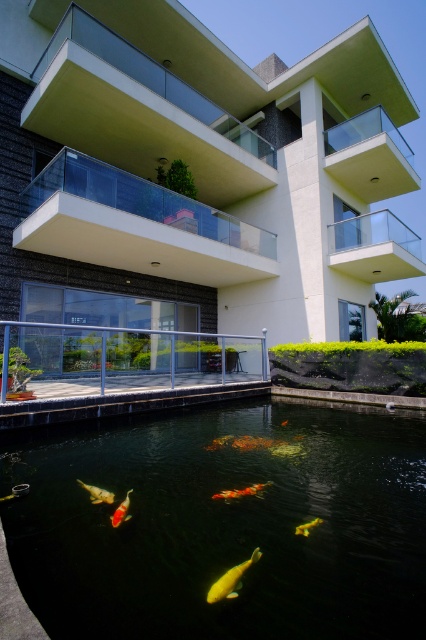
Is point (121, 516) closer to viewer compared to point (299, 532)?

No, (121, 516) is behind (299, 532).

Does shiny orange fish at center lie in front of shiny orange fish at lower center?

No.

Does point (114, 518) lie behind point (305, 529)?

Yes.

What are the coordinates of `shiny orange fish at center` in the screenshot? It's located at (120, 512).

Which is above, transparent glass balcony at upper center or yellow shiny fish at center?

transparent glass balcony at upper center is above.

Which is in front, point (138, 164) or point (238, 582)?

Positioned in front is point (238, 582).

Locate an element on the screen. This screenshot has width=426, height=640. transparent glass balcony at upper center is located at coordinates (140, 113).

Between point (89, 490) and point (301, 531), which one is positioned behind?

The point (89, 490) is more distant.

Is shiny gold fish at center to the left of shiny orange fish at lower center from the viewer's perspective?

Correct, you'll find shiny gold fish at center to the left of shiny orange fish at lower center.

I want to click on shiny gold fish at center, so click(97, 493).

Image resolution: width=426 pixels, height=640 pixels. Find the location of `shiny gold fish at center`. shiny gold fish at center is located at coordinates (97, 493).